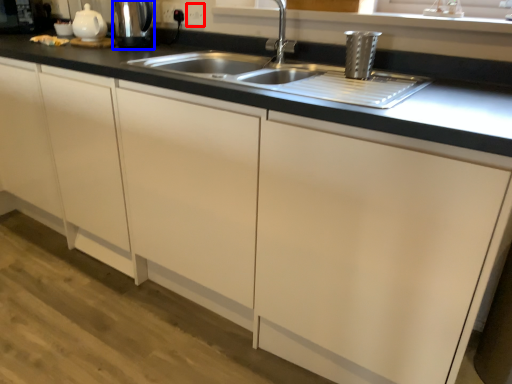
Question: Which point is further to the camera, electric outlet (highlighted by a red box) or appliance (highlighted by a blue box)?

Choices:
 (A) electric outlet
 (B) appliance

Answer: (A)